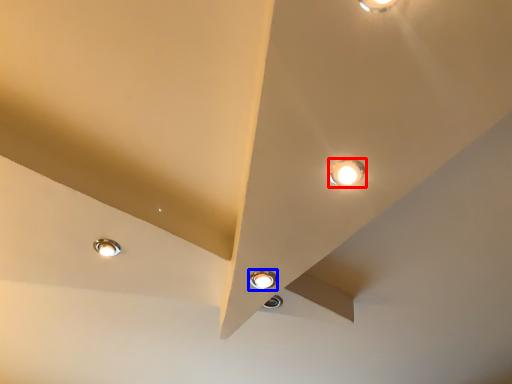
Question: Which of the following is the farthest to the observer, lamp (highlighted by a red box) or lamp (highlighted by a blue box)?

Choices:
 (A) lamp
 (B) lamp

Answer: (B)